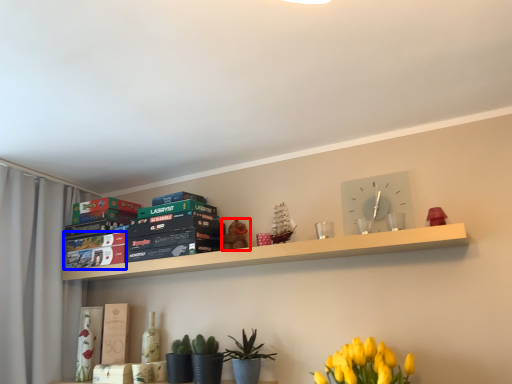
Question: Among these objects, which one is farthest to the camera, toy (highlighted by a red box) or paperback book (highlighted by a blue box)?

Choices:
 (A) toy
 (B) paperback book

Answer: (B)